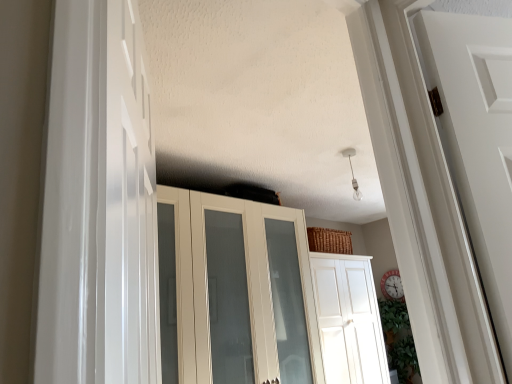
Question: Is white glossy cupboard at center directly adjacent to white glossy door at left, which is counted as the 1th door, starting from the front?

Choices:
 (A) yes
 (B) no

Answer: (B)

Question: Is white glossy door at left, the first door from the top, surrounded by white glossy cupboard at center?

Choices:
 (A) yes
 (B) no

Answer: (B)

Question: From the image's perspective, is white glossy cupboard at center on top of white glossy door at left, arranged as the 2th door when viewed from the right?

Choices:
 (A) no
 (B) yes

Answer: (A)

Question: From the image's perspective, would you say white glossy cupboard at center is shown under white glossy door at left, which is counted as the 1th door, starting from the front?

Choices:
 (A) no
 (B) yes

Answer: (B)

Question: From a real-world perspective, is white glossy cupboard at center positioned over white glossy door at left, which is counted as the 1th door, starting from the front, based on gravity?

Choices:
 (A) yes
 (B) no

Answer: (B)

Question: Visually, is white glossy door at center, acting as the second door starting from the left, positioned to the left or to the right of white glossy cupboard at center?

Choices:
 (A) left
 (B) right

Answer: (B)

Question: Considering their positions, is white glossy door at center, marked as the first door in a right-to-left arrangement, located in front of or behind white glossy cupboard at center?

Choices:
 (A) behind
 (B) front

Answer: (A)

Question: In terms of size, does white glossy door at center, the 2th door in the top-to-bottom sequence, appear bigger or smaller than white glossy cupboard at center?

Choices:
 (A) big
 (B) small

Answer: (B)

Question: From a real-world perspective, is white glossy door at center, acting as the second door starting from the left, positioned above or below white glossy cupboard at center?

Choices:
 (A) below
 (B) above

Answer: (A)

Question: Is point coord(198,365) closer or farther from the camera than point coord(144,355)?

Choices:
 (A) farther
 (B) closer

Answer: (A)

Question: From a real-world perspective, is white glossy cupboard at center physically located above or below white glossy door at left, the first door from the top?

Choices:
 (A) below
 (B) above

Answer: (A)

Question: Considering the positions of white glossy cupboard at center and white glossy door at left, the second door when ordered from bottom to top, in the image, is white glossy cupboard at center wider or thinner than white glossy door at left, the second door when ordered from bottom to top,?

Choices:
 (A) wide
 (B) thin

Answer: (A)

Question: Is white glossy cupboard at center taller or shorter than white glossy door at left, positioned as the second door in back-to-front order?

Choices:
 (A) short
 (B) tall

Answer: (B)

Question: Does point click(109, 380) appear closer or farther from the camera than point click(317, 284)?

Choices:
 (A) farther
 (B) closer

Answer: (B)

Question: Is white glossy door at left, the first door from the top, inside or outside of white glossy door at center, the 2th door in the top-to-bottom sequence?

Choices:
 (A) outside
 (B) inside

Answer: (A)